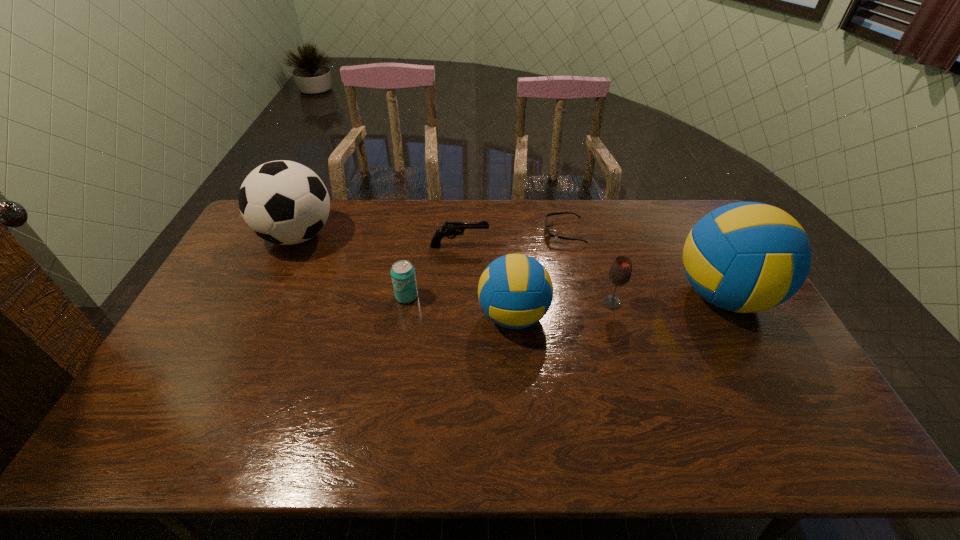
At what (x,y) coordinates should I click in order to perform the action: click on the left volleyball. Please return your answer as a coordinate pair (x, y). The width and height of the screenshot is (960, 540). Looking at the image, I should click on (515, 291).

Locate an element on the screen. the shorter volleyball is located at coordinates (515, 291).

The height and width of the screenshot is (540, 960). Find the location of `the taller volleyball`. the taller volleyball is located at coordinates (745, 257).

Image resolution: width=960 pixels, height=540 pixels. I want to click on the right volleyball, so point(745,257).

You are a GUI agent. You are given a task and a screenshot of the screen. Output one action in this format:
    pyautogui.click(x=<x>, y=<y>)
    Task: Click on the soccer ball
    This screenshot has width=960, height=540.
    Given the screenshot: What is the action you would take?
    pyautogui.click(x=283, y=202)

Locate an element on the screen. the shortest object is located at coordinates (549, 234).

This screenshot has height=540, width=960. I want to click on gun, so click(x=450, y=229).

Locate an element on the screen. This screenshot has height=540, width=960. the second object from left to right is located at coordinates (403, 276).

Locate an element on the screen. Image resolution: width=960 pixels, height=540 pixels. glass drink container is located at coordinates (620, 272).

At what (x,y) coordinates should I click in order to perform the action: click on free region located on the right of the fifth shortest object. Please return your answer as a coordinate pair (x, y). Image resolution: width=960 pixels, height=540 pixels. Looking at the image, I should click on (580, 316).